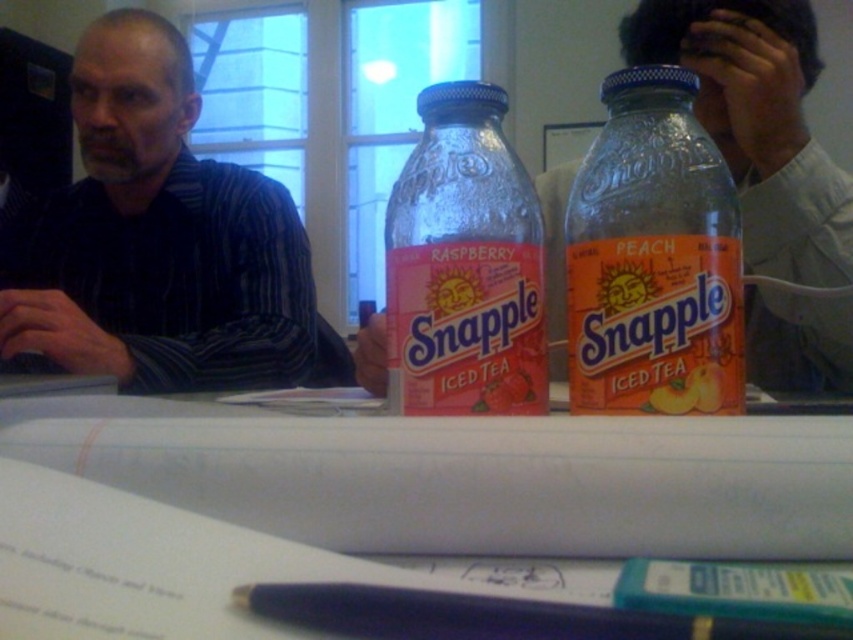
You are a guest at a dinner and you want to read the note on the white paper at center. Can you reach it without moving the matte plastic snapple iced tea at center?

The white paper at center is closer to the viewer than the matte plastic snapple iced tea at center, so yes, you can reach the white paper at center without moving the matte plastic snapple iced tea at center because it is farther away.

You are organizing a small meeting and need to place a blue plastic pen at center on the white paper at center. Will the pen fit entirely on the paper without hanging off the edges?

The white paper at center has a larger width than the blue plastic pen at center, so the pen will fit entirely on the paper without hanging off the edges.

You are setting up a table for a small gathering and want to place a decorative item near the clear glass bottle at center. Where exactly should you place it to ensure it aligns with the coordinates provided?

The clear glass bottle at center is located at point (653, 259), so you should place the decorative item near those coordinates to align with it.